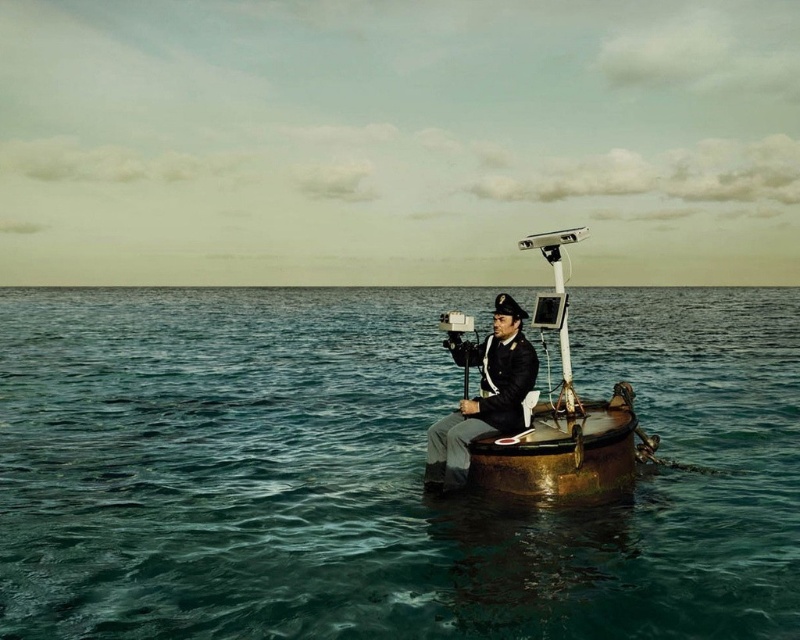
Question: Is rusty metal bucket at center above matte black uniform at center?

Choices:
 (A) yes
 (B) no

Answer: (A)

Question: Does rusty metal bucket at center have a larger size compared to matte black uniform at center?

Choices:
 (A) no
 (B) yes

Answer: (A)

Question: Which point is closer to the camera taking this photo?

Choices:
 (A) (106, 355)
 (B) (452, 316)

Answer: (B)

Question: Estimate the real-world distances between objects in this image. Which object is closer to the greenish-blue water at center?

Choices:
 (A) matte black uniform at center
 (B) rusty metal bucket at center

Answer: (A)

Question: Which of the following is the closest to the observer?

Choices:
 (A) greenish-blue water at center
 (B) matte black uniform at center

Answer: (A)

Question: Is greenish-blue water at center wider than matte black uniform at center?

Choices:
 (A) yes
 (B) no

Answer: (A)